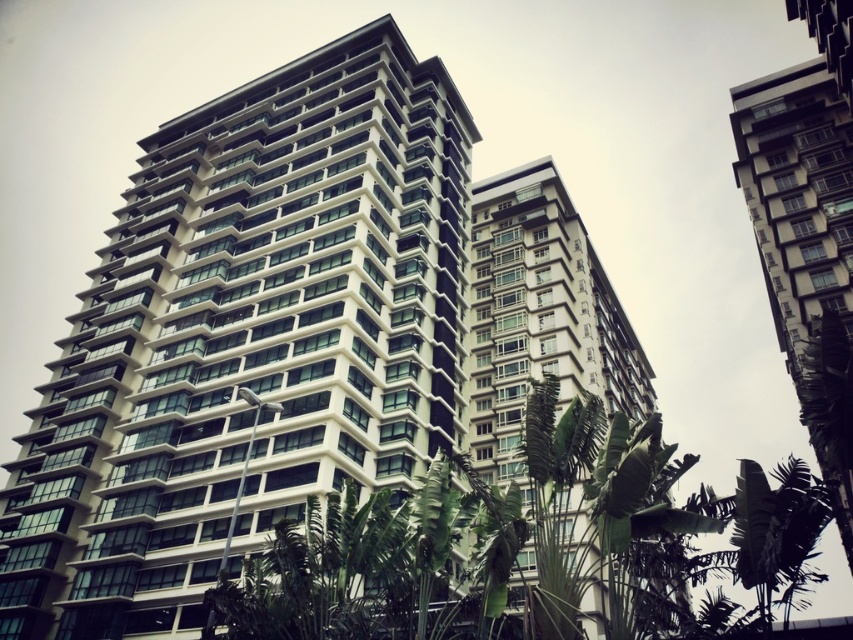
Question: Which object appears closest to the camera in this image?

Choices:
 (A) white glossy building at center
 (B) white glass building at center

Answer: (A)

Question: Considering the relative positions of white glossy building at center and green leafy tree at center in the image provided, where is white glossy building at center located with respect to green leafy tree at center?

Choices:
 (A) right
 (B) left

Answer: (B)

Question: Which is nearer to the white glossy building at center?

Choices:
 (A) green leafy tree at center
 (B) white glass building at center

Answer: (B)

Question: Which of the following is the farthest from the observer?

Choices:
 (A) green leafy tree at center
 (B) white glass building at center
 (C) white glossy building at center

Answer: (B)

Question: Considering the relative positions of white glossy building at center and white glass building at center in the image provided, where is white glossy building at center located with respect to white glass building at center?

Choices:
 (A) left
 (B) right

Answer: (A)

Question: Is white glossy building at center to the right of green leafy tree at center from the viewer's perspective?

Choices:
 (A) yes
 (B) no

Answer: (B)